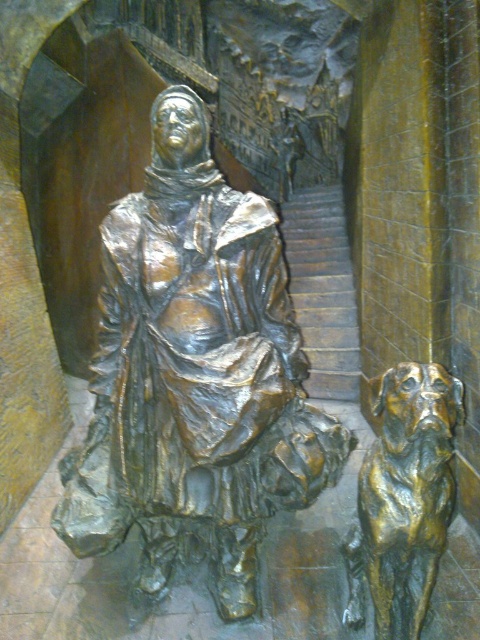
Between point (231, 228) and point (365, 556), which one is positioned in front?

Point (365, 556)

Can you confirm if bronze statue at center is positioned above shiny bronze dog at lower right?

Correct, bronze statue at center is located above shiny bronze dog at lower right.

Identify the location of bronze statue at center. (194, 376).